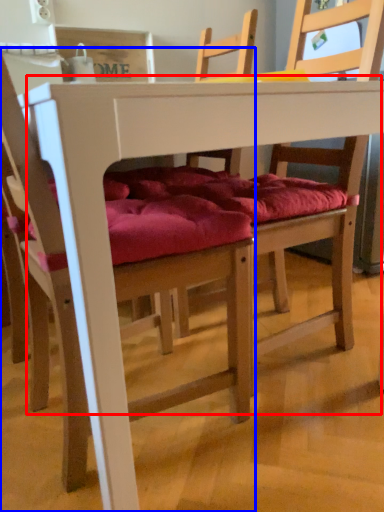
Question: Which object is closer to the camera taking this photo, table (highlighted by a red box) or chair (highlighted by a blue box)?

Choices:
 (A) table
 (B) chair

Answer: (B)